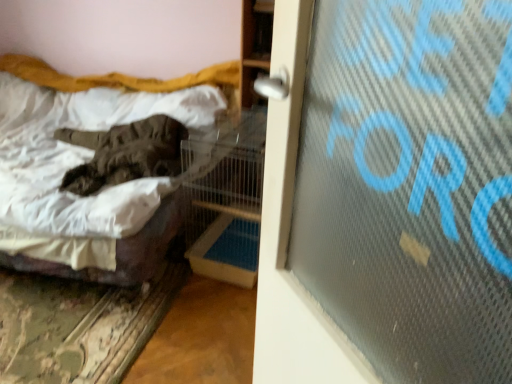
The width and height of the screenshot is (512, 384). What are the coordinates of `velvet brown blanket at left` in the screenshot? It's located at (126, 79).

From the picture: Measure the distance between velvet brown blanket at left and camera.

7.57 feet.

What is the approximate width of velvet brown blanket at left?

The width of velvet brown blanket at left is 1.38 meters.

The height and width of the screenshot is (384, 512). What do you see at coordinates (126, 79) in the screenshot?
I see `velvet brown blanket at left` at bounding box center [126, 79].

The width and height of the screenshot is (512, 384). I want to click on velvet brown blanket at left, so click(126, 79).